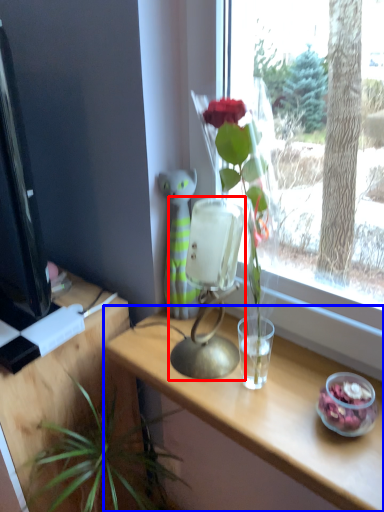
Question: Which point is further to the camera, table lamp (highlighted by a red box) or table (highlighted by a blue box)?

Choices:
 (A) table lamp
 (B) table

Answer: (A)